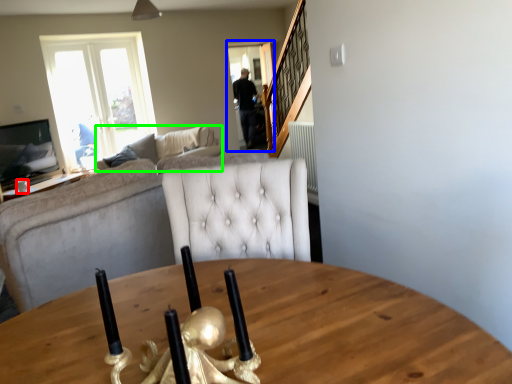
Question: Considering the real-world distances, which object is farthest from coffee cup (highlighted by a red box)? glass door (highlighted by a blue box) or studio couch (highlighted by a green box)?

Choices:
 (A) glass door
 (B) studio couch

Answer: (A)